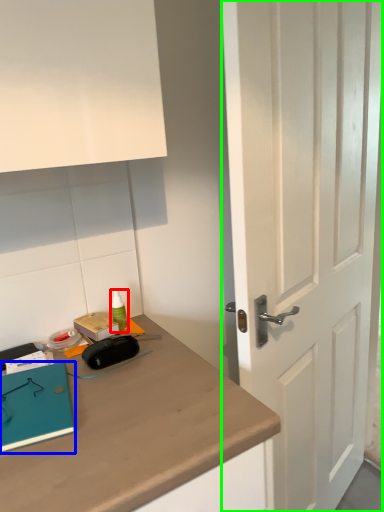
Question: Estimate the real-world distances between objects in this image. Which object is closer to stationery (highlighted by a red box), notebook (highlighted by a blue box) or door (highlighted by a green box)?

Choices:
 (A) notebook
 (B) door

Answer: (A)